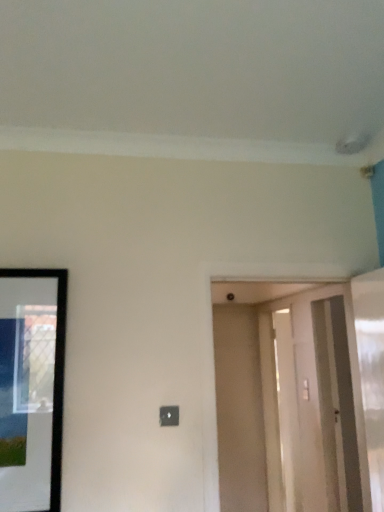
Question: Do you think black glossy picture frame at left is within clear glass screen door at right, or outside of it?

Choices:
 (A) outside
 (B) inside

Answer: (A)

Question: Is point (44, 413) closer or farther from the camera than point (354, 497)?

Choices:
 (A) closer
 (B) farther

Answer: (A)

Question: Estimate the real-world distances between objects in this image. Which object is farther from the smooth beige door at center?

Choices:
 (A) black glossy picture frame at left
 (B) clear glass screen door at right

Answer: (A)

Question: Considering the real-world distances, which object is closest to the black glossy picture frame at left?

Choices:
 (A) clear glass screen door at right
 (B) smooth beige door at center

Answer: (A)